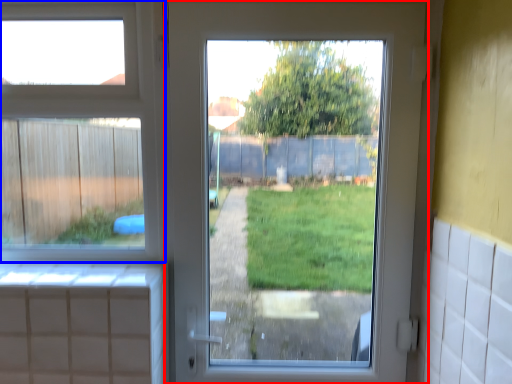
Question: Which point is further to the camera, door (highlighted by a red box) or window (highlighted by a blue box)?

Choices:
 (A) door
 (B) window

Answer: (B)